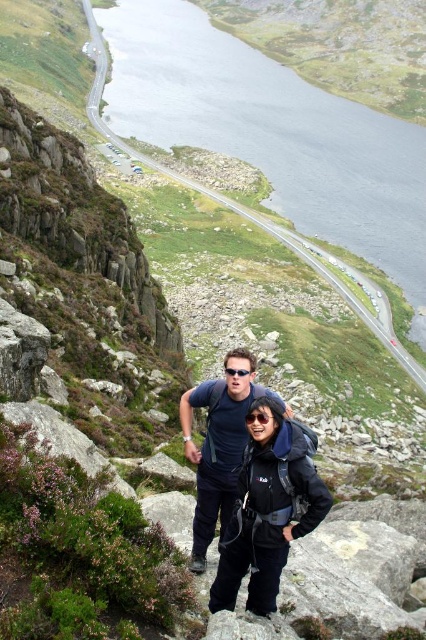
You are a hiker trying to identify items in the scene. Which object, the matte black jacket at center or the black matte goggles at center, takes up less space in the image?

The matte black jacket at center is smaller than the black matte goggles at center, so it takes up less space in the image.

You are a photographer trying to capture a clear shot of the matte black jacket at center and the black matte goggles at center. Which object should you focus on first if you want to ensure both are in the frame without moving the camera?

The matte black jacket at center is positioned on the right side of black matte goggles at center, so you should focus on the black matte goggles at center first to ensure both are in the frame without moving the camera.